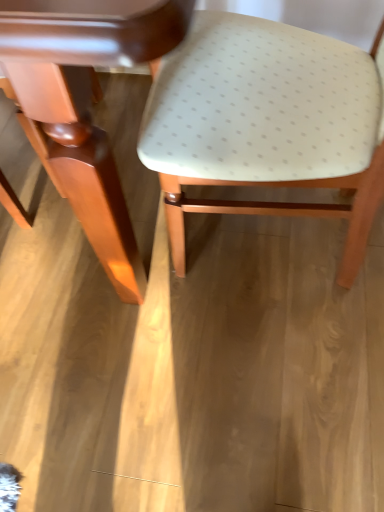
Question: Considering the relative positions of matte white plastic chair at center and matte white table at center in the image provided, is matte white plastic chair at center to the right of matte white table at center from the viewer's perspective?

Choices:
 (A) no
 (B) yes

Answer: (B)

Question: From a real-world perspective, is matte white plastic chair at center positioned over matte white table at center based on gravity?

Choices:
 (A) yes
 (B) no

Answer: (B)

Question: From a real-world perspective, is matte white plastic chair at center beneath matte white table at center?

Choices:
 (A) no
 (B) yes

Answer: (B)

Question: Is matte white plastic chair at center directly adjacent to matte white table at center?

Choices:
 (A) no
 (B) yes

Answer: (A)

Question: Does matte white plastic chair at center appear on the left side of matte white table at center?

Choices:
 (A) no
 (B) yes

Answer: (A)

Question: Considering the relative positions of matte white plastic chair at center and matte white table at center in the image provided, is matte white plastic chair at center in front of matte white table at center?

Choices:
 (A) yes
 (B) no

Answer: (B)

Question: Is matte white table at center taller than matte white plastic chair at center?

Choices:
 (A) yes
 (B) no

Answer: (A)

Question: Would you say matte white table at center is a long distance from matte white plastic chair at center?

Choices:
 (A) yes
 (B) no

Answer: (B)

Question: Is matte white table at center positioned behind matte white plastic chair at center?

Choices:
 (A) no
 (B) yes

Answer: (A)

Question: Is matte white table at center thinner than matte white plastic chair at center?

Choices:
 (A) no
 (B) yes

Answer: (A)

Question: Does matte white table at center have a larger size compared to matte white plastic chair at center?

Choices:
 (A) no
 (B) yes

Answer: (B)

Question: Can you confirm if matte white table at center is shorter than matte white plastic chair at center?

Choices:
 (A) yes
 (B) no

Answer: (B)

Question: Is matte white table at center wider or thinner than matte white plastic chair at center?

Choices:
 (A) thin
 (B) wide

Answer: (B)